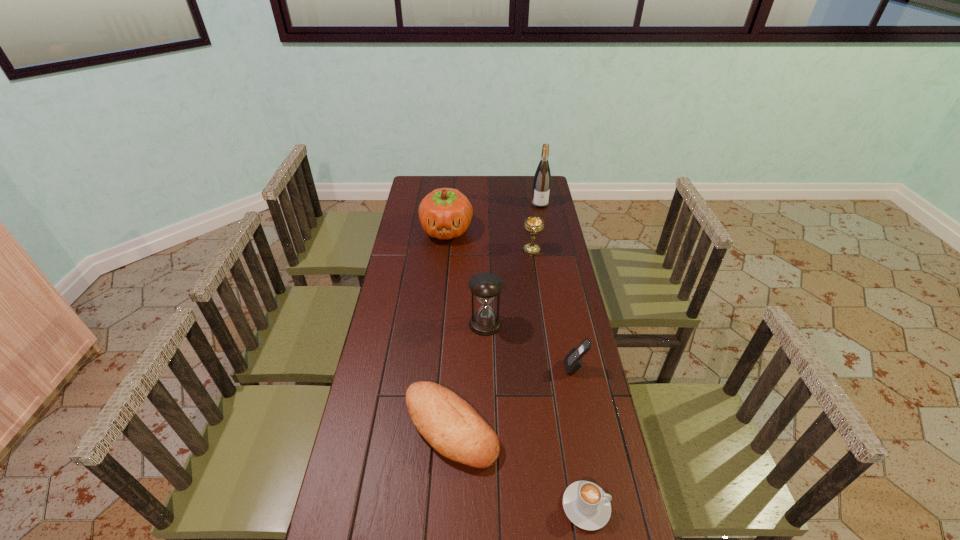
The width and height of the screenshot is (960, 540). What are the coordinates of `bread situated at the left edge` in the screenshot? It's located at (448, 423).

I want to click on wine bottle that is at the right edge, so coord(542,179).

Where is `chalice present at the right edge`? chalice present at the right edge is located at coordinates (533, 224).

This screenshot has height=540, width=960. I want to click on cellular telephone that is at the right edge, so click(573, 362).

Find the location of `cappuccino situated at the right edge`. cappuccino situated at the right edge is located at coordinates [x=587, y=506].

Where is `free region at the far edge`? free region at the far edge is located at coordinates (456, 177).

What are the coordinates of `free space at the left edge of the desktop` in the screenshot? It's located at (404, 297).

Where is `vacant space at the right edge of the desktop`? The width and height of the screenshot is (960, 540). vacant space at the right edge of the desktop is located at coordinates (545, 270).

At what (x,y) coordinates should I click in order to perform the action: click on vacant area that lies between the farthest object and the fifth farthest object. Please return your answer as a coordinate pair (x, y). Looking at the image, I should click on (558, 286).

The height and width of the screenshot is (540, 960). What are the coordinates of `free spot between the hourglass and the cellular telephone` in the screenshot? It's located at (530, 346).